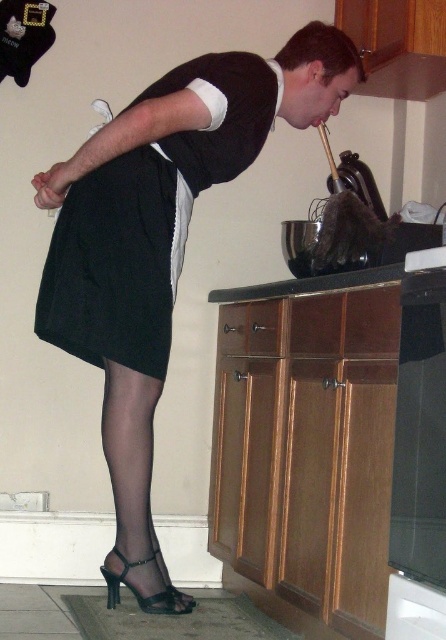
Who is more distant from viewer, (118, 356) or (107, 602)?

Positioned behind is point (107, 602).

Can you confirm if black fabric dress at center is positioned to the right of black sheer stocking at lower left?

Yes, black fabric dress at center is to the right of black sheer stocking at lower left.

Which is behind, point (66, 276) or point (119, 589)?

The point (119, 589) is more distant.

Locate an element on the screen. The image size is (446, 640). black fabric dress at center is located at coordinates (148, 218).

Between point (112, 400) and point (136, 564), which one is positioned in front?

Point (112, 400) is in front.

Where is `black sheer tights at lower left`? The image size is (446, 640). black sheer tights at lower left is located at coordinates (133, 492).

Is black matte dress at center below black fabric dress at center?

Indeed, black matte dress at center is positioned under black fabric dress at center.

Consider the image. Between black matte dress at center and black fabric dress at center, which one appears on the right side from the viewer's perspective?

black matte dress at center is more to the right.

Does point (236, 115) lie behind point (65, 323)?

No.

At what (x,y) coordinates should I click in order to perform the action: click on black matte dress at center. Please return your answer as a coordinate pair (x, y). Looking at the image, I should click on (161, 234).